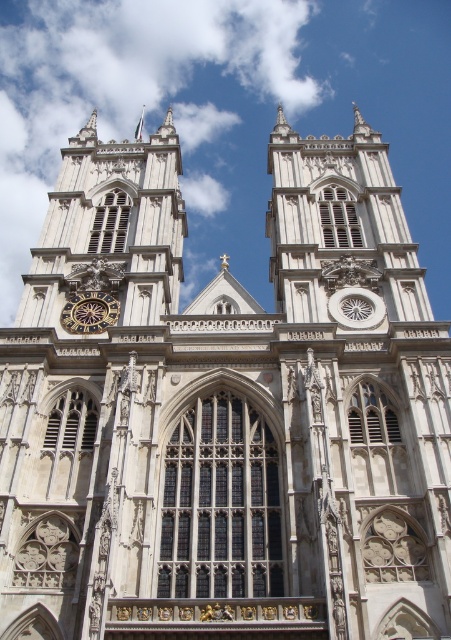
From the picture: You are standing at the entrance of Westminster Abbey and notice a white fluffy cloud at upper center and a white stone clock tower at upper left. Which object is farther away from you?

The white fluffy cloud at upper center is farther away from you since it is 62.13 meters away from the white stone clock tower at upper left, which is closer to the entrance.

You are a tourist visiting Westminster Abbey and notice the white fluffy cloud at upper center and the goldmetallicclock at lower center in the sky. Which object appears larger in the image?

The white fluffy cloud at upper center appears larger than the goldmetallicclock at lower center in the image.

You are standing in front of Westminster Abbey and notice a point marked at coordinates [151,108]. What is located at this point?

The point at coordinates [151,108] corresponds to a white fluffy cloud at upper center.